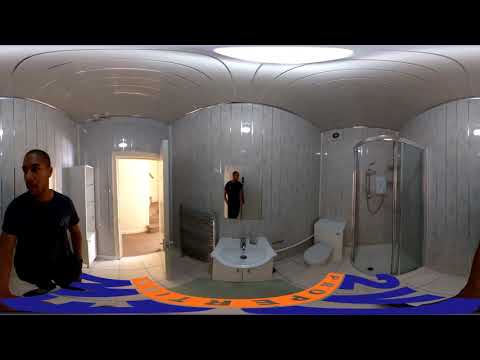
I want to click on shelf unit, so click(x=80, y=183).